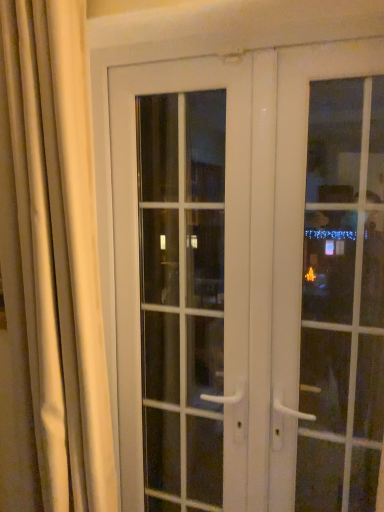
Question: Considering the relative sizes of white glossy door at right, which is the first door in right-to-left order, and silky beige curtain at left in the image provided, is white glossy door at right, which is the first door in right-to-left order, taller than silky beige curtain at left?

Choices:
 (A) no
 (B) yes

Answer: (A)

Question: Is white glossy door at right, which is the first door in right-to-left order, to the right of silky beige curtain at left from the viewer's perspective?

Choices:
 (A) yes
 (B) no

Answer: (A)

Question: Is white glossy door at right, placed as the third door when sorted from left to right, not close to silky beige curtain at left?

Choices:
 (A) no
 (B) yes

Answer: (A)

Question: From a real-world perspective, is white glossy door at right, placed as the third door when sorted from left to right, positioned under silky beige curtain at left based on gravity?

Choices:
 (A) yes
 (B) no

Answer: (A)

Question: Is white glossy door at right, which is the first door in right-to-left order, bigger than silky beige curtain at left?

Choices:
 (A) no
 (B) yes

Answer: (A)

Question: In the image, is silky beige curtain at left on the left side or the right side of white glass door at center, acting as the first door starting from the left?

Choices:
 (A) right
 (B) left

Answer: (B)

Question: From a real-world perspective, is silky beige curtain at left physically located above or below white glass door at center, acting as the first door starting from the left?

Choices:
 (A) below
 (B) above

Answer: (B)

Question: From their relative heights in the image, would you say silky beige curtain at left is taller or shorter than white glass door at center, which is counted as the 3th door, starting from the right?

Choices:
 (A) tall
 (B) short

Answer: (B)

Question: Is silky beige curtain at left inside the boundaries of white glass door at center, acting as the first door starting from the left, or outside?

Choices:
 (A) outside
 (B) inside

Answer: (A)

Question: Is point (271, 242) closer or farther from the camera than point (190, 117)?

Choices:
 (A) farther
 (B) closer

Answer: (B)

Question: In the image, is white glossy door at center, which is counted as the second door, starting from the left, positioned in front of or behind white glass door at center, acting as the first door starting from the left?

Choices:
 (A) behind
 (B) front

Answer: (B)

Question: Based on their sizes in the image, would you say white glossy door at center, the second door in the right-to-left sequence, is bigger or smaller than white glass door at center, which is counted as the 3th door, starting from the right?

Choices:
 (A) big
 (B) small

Answer: (B)

Question: From the image's perspective, relative to white glass door at center, which is counted as the 3th door, starting from the right, is white glossy door at center, which is counted as the second door, starting from the left, above or below?

Choices:
 (A) below
 (B) above

Answer: (B)

Question: Is white glass door at center, acting as the first door starting from the left, to the left or to the right of white glossy door at right, placed as the third door when sorted from left to right, in the image?

Choices:
 (A) right
 (B) left

Answer: (B)

Question: From the image's perspective, is white glass door at center, which is counted as the 3th door, starting from the right, positioned above or below white glossy door at right, placed as the third door when sorted from left to right?

Choices:
 (A) below
 (B) above

Answer: (A)